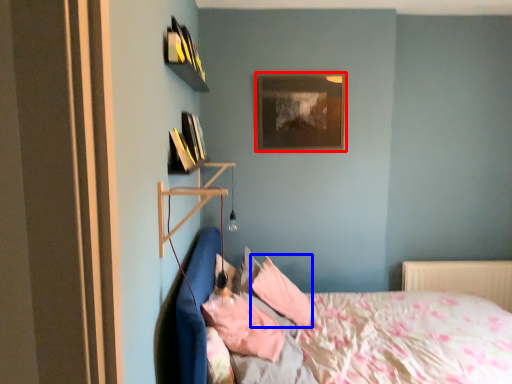
Question: Which of the following is the farthest to the observer, picture frame (highlighted by a red box) or pillow (highlighted by a blue box)?

Choices:
 (A) picture frame
 (B) pillow

Answer: (A)